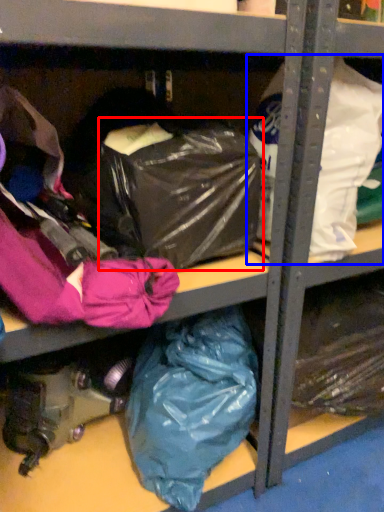
Question: Which point is closer to the camera, bag (highlighted by a red box) or plastic bag (highlighted by a blue box)?

Choices:
 (A) bag
 (B) plastic bag

Answer: (A)